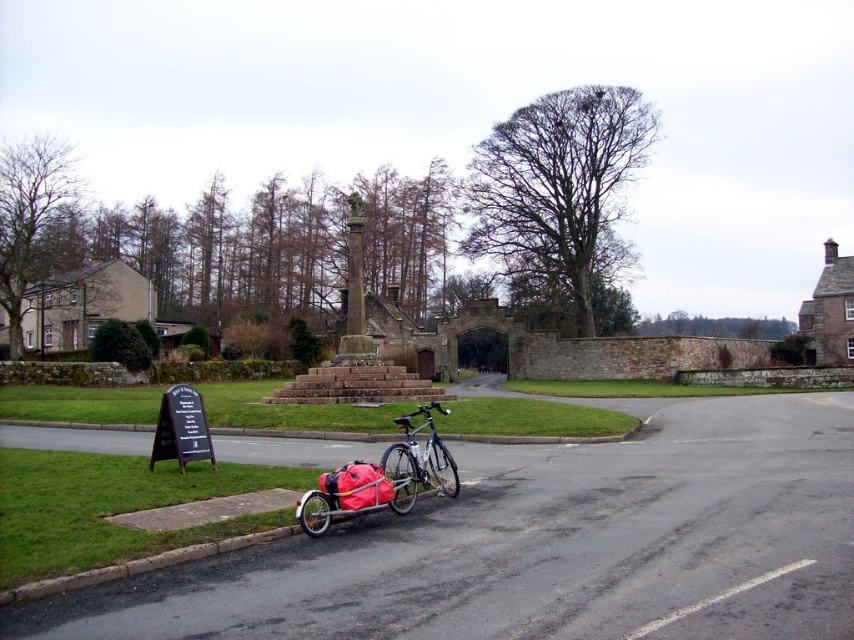
Question: Is silver metallic bicycle at lower center to the right of silver metallic bicycle at center from the viewer's perspective?

Choices:
 (A) no
 (B) yes

Answer: (A)

Question: Does silver metallic bicycle at lower center have a smaller size compared to silver metallic bicycle at center?

Choices:
 (A) no
 (B) yes

Answer: (A)

Question: Which object appears farthest from the camera in this image?

Choices:
 (A) silver metallic bicycle at center
 (B) silver metallic bicycle at lower center

Answer: (A)

Question: Which point is closer to the camera?

Choices:
 (A) (402, 497)
 (B) (408, 508)

Answer: (B)

Question: Is silver metallic bicycle at lower center further to the viewer compared to silver metallic bicycle at center?

Choices:
 (A) yes
 (B) no

Answer: (B)

Question: Which of the following is the farthest from the observer?

Choices:
 (A) (393, 445)
 (B) (443, 449)

Answer: (B)